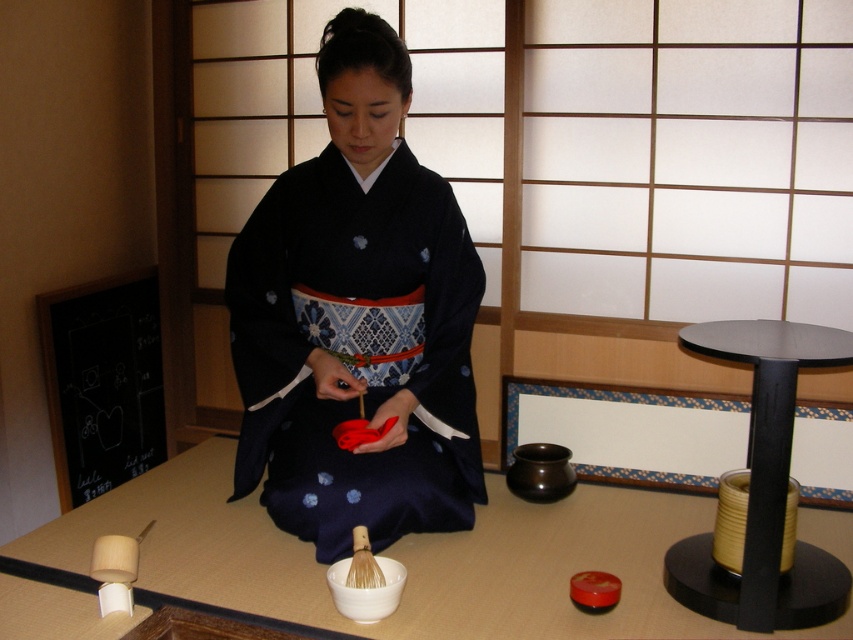
Question: Does matte black kimono at center come behind black matte table at right?

Choices:
 (A) no
 (B) yes

Answer: (B)

Question: Which point is farther to the camera?

Choices:
 (A) (833, 536)
 (B) (717, 346)

Answer: (A)

Question: Considering the real-world distances, which object is farthest from the black matte table at right?

Choices:
 (A) smooth wooden table at center
 (B) matte black kimono at center

Answer: (B)

Question: Is smooth wooden table at center behind black matte table at right?

Choices:
 (A) yes
 (B) no

Answer: (A)

Question: Based on their relative distances, which object is farther from the matte black kimono at center?

Choices:
 (A) black matte table at right
 (B) smooth wooden table at center

Answer: (A)

Question: Is smooth wooden table at center positioned in front of black matte table at right?

Choices:
 (A) no
 (B) yes

Answer: (A)